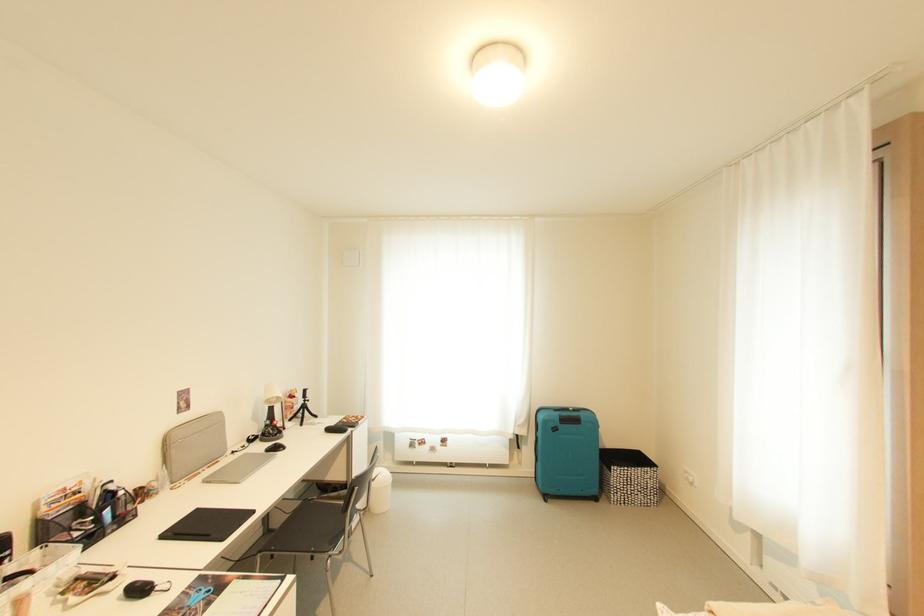
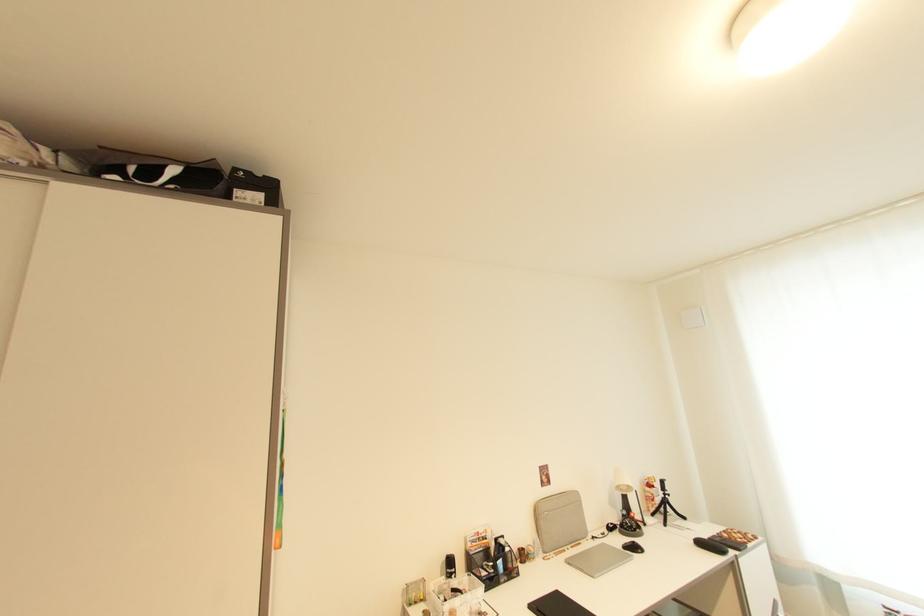
Where in the second image is the point corresponding to the point at 202,512 from the first image?

(562, 594)